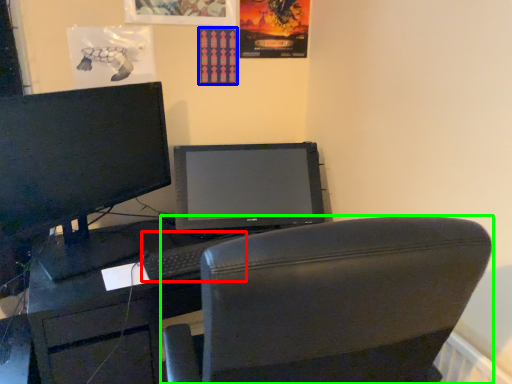
Question: Estimate the real-world distances between objects in this image. Which object is farther from keyboard (highlighted by a red box), poster page (highlighted by a blue box) or chair (highlighted by a green box)?

Choices:
 (A) poster page
 (B) chair

Answer: (A)